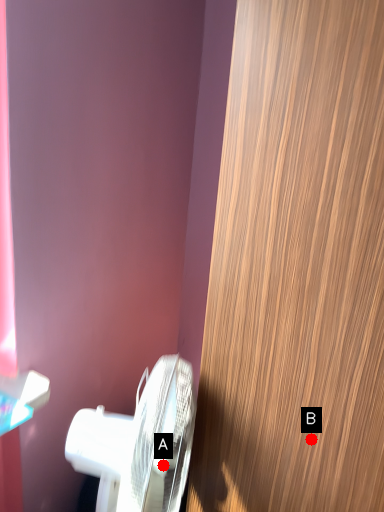
Question: Two points are circled on the image, labeled by A and B beside each circle. Which point appears closest to the camera in this image?

Choices:
 (A) A is closer
 (B) B is closer

Answer: (A)